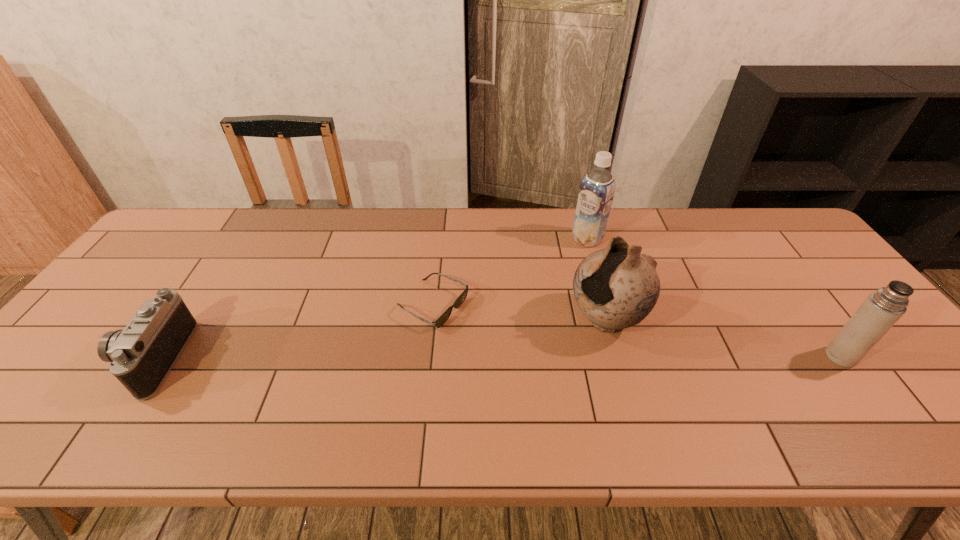
Find the location of a particular element. vacant space located 0.120m on the front-facing side of the leftmost object is located at coordinates (77, 359).

Locate an element on the screen. vacant space located 0.110m on the right of the third tallest object is located at coordinates (900, 356).

Where is `vacant space located on the front-facing side of the sunglasses`? This screenshot has height=540, width=960. vacant space located on the front-facing side of the sunglasses is located at coordinates (482, 329).

Locate an element on the screen. blank space located 0.330m on the front-facing side of the sunglasses is located at coordinates (581, 376).

Where is `free space located 0.100m on the front-facing side of the sunglasses`? free space located 0.100m on the front-facing side of the sunglasses is located at coordinates (495, 335).

You are a GUI agent. You are given a task and a screenshot of the screen. Output one action in this format:
    pyautogui.click(x=<x>, y=<y>)
    Task: Click on the blank space located 0.060m from the spout of the pottery
    
    Given the screenshot: What is the action you would take?
    pyautogui.click(x=561, y=348)

Locate an element on the screen. This screenshot has height=540, width=960. vacant space located from the spout of the pottery is located at coordinates (540, 362).

What are the coordinates of `vacant space situated from the spout of the pottery` in the screenshot? It's located at (507, 383).

Image resolution: width=960 pixels, height=540 pixels. What are the coordinates of `free space located 0.280m on the label of the farthest object` in the screenshot? It's located at (523, 294).

The width and height of the screenshot is (960, 540). I want to click on free space located 0.180m on the label of the farthest object, so click(544, 275).